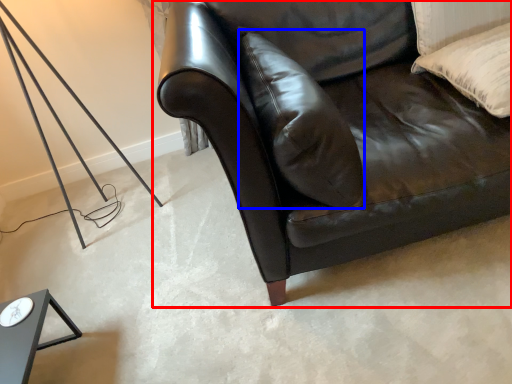
Question: Among these objects, which one is nearest to the camera, studio couch (highlighted by a red box) or pillow (highlighted by a blue box)?

Choices:
 (A) studio couch
 (B) pillow

Answer: (A)